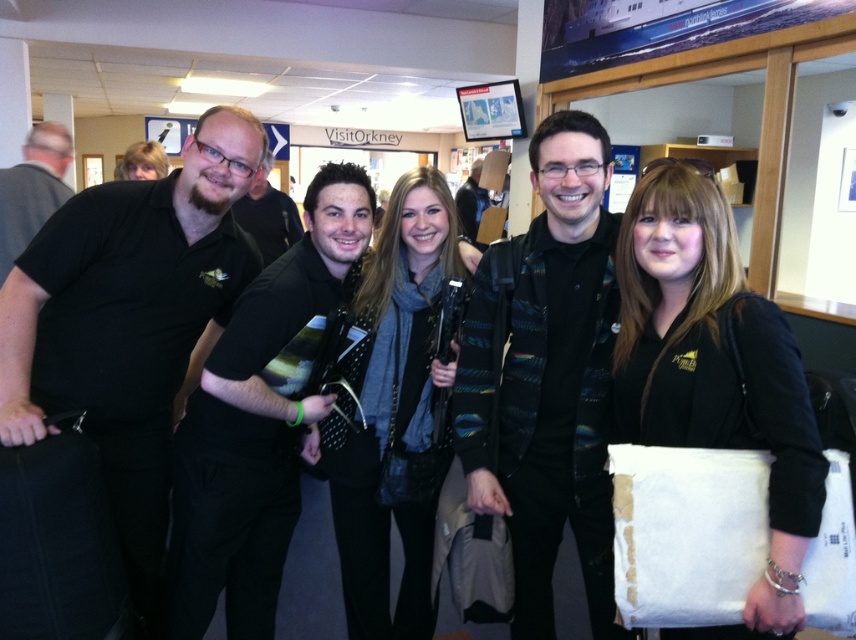
Is black matte shirt at left further to camera compared to patterned sweater at center?

No, it is in front of patterned sweater at center.

Is black matte shirt at left taller than patterned sweater at center?

→ Correct, black matte shirt at left is much taller as patterned sweater at center.

This screenshot has height=640, width=856. What are the coordinates of `black matte shirt at left` in the screenshot? It's located at (129, 323).

Where is `black matte shirt at left`? black matte shirt at left is located at coordinates (129, 323).